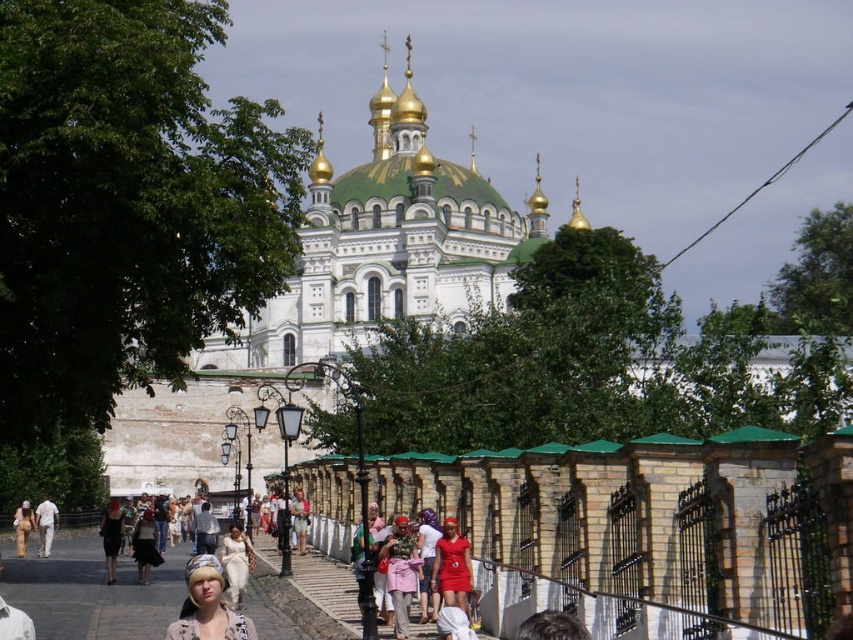
Question: Which object appears farthest from the camera in this image?

Choices:
 (A) denim jacket at lower left
 (B) light beige fabric headscarf at lower center
 (C) matte red dress at center

Answer: (A)

Question: Is camouflage-patterned shirt at center above matte red dress at center?

Choices:
 (A) yes
 (B) no

Answer: (A)

Question: Among these objects, which one is nearest to the camera?

Choices:
 (A) camouflage-patterned shirt at center
 (B) denim jacket at lower left
 (C) white cotton dress at center
 (D) cobblestone pathway at center

Answer: (D)

Question: Which of the following is the closest to the observer?

Choices:
 (A) cobblestone pathway at center
 (B) matte red dress at center
 (C) white cotton pants at center
 (D) white cotton dress at center

Answer: (A)

Question: Is cobblestone pathway at center closer to the viewer compared to matte red dress at center?

Choices:
 (A) no
 (B) yes

Answer: (B)

Question: Is white stone church at center smaller than denim jacket at lower left?

Choices:
 (A) no
 (B) yes

Answer: (A)